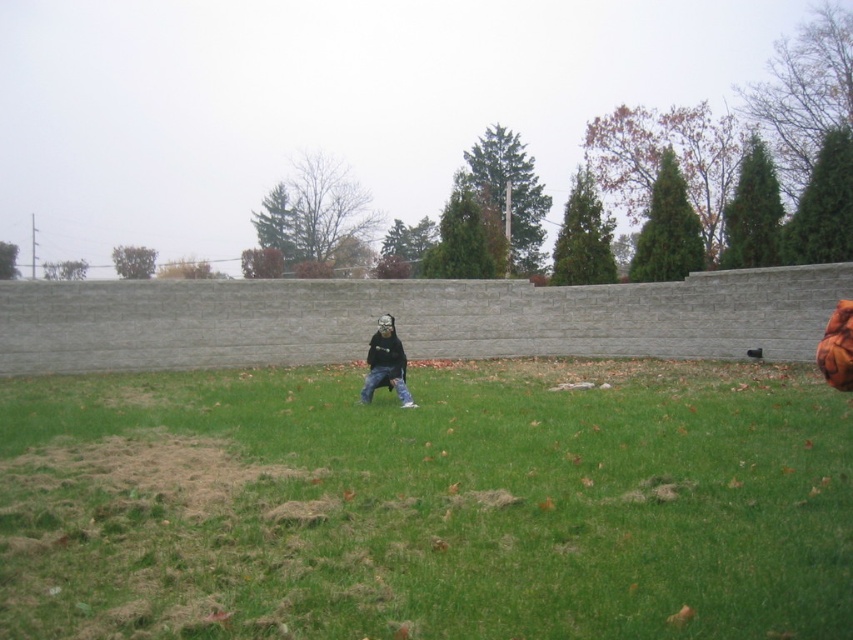
Question: Is green grass at center behind matte black mask at center?

Choices:
 (A) yes
 (B) no

Answer: (B)

Question: Does green grass at center appear on the left side of matte black mask at center?

Choices:
 (A) yes
 (B) no

Answer: (B)

Question: Which point appears farthest from the camera in this image?

Choices:
 (A) (383, 376)
 (B) (134, 412)

Answer: (A)

Question: Does green grass at center lie behind matte black mask at center?

Choices:
 (A) yes
 (B) no

Answer: (B)